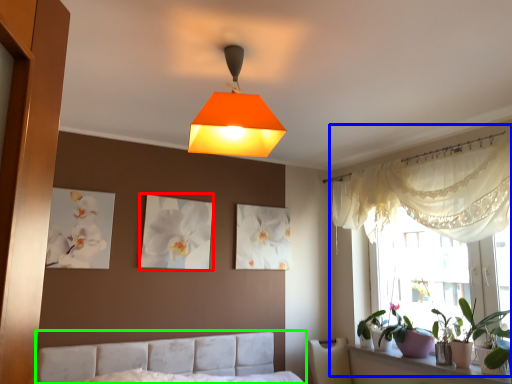
Question: Considering the real-world distances, which object is farthest from picture frame (highlighted by a red box)? bay window (highlighted by a blue box) or bed (highlighted by a green box)?

Choices:
 (A) bay window
 (B) bed

Answer: (A)